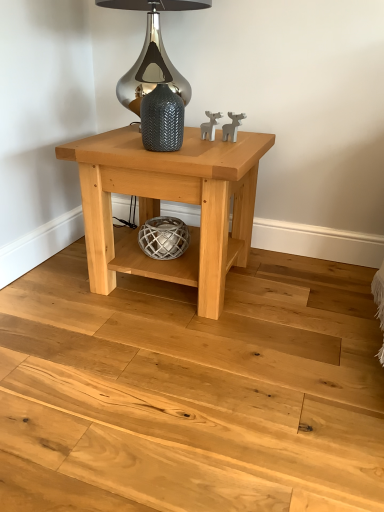
The height and width of the screenshot is (512, 384). Find the location of `free space on the front side of textured gray vase at center`. free space on the front side of textured gray vase at center is located at coordinates click(x=169, y=157).